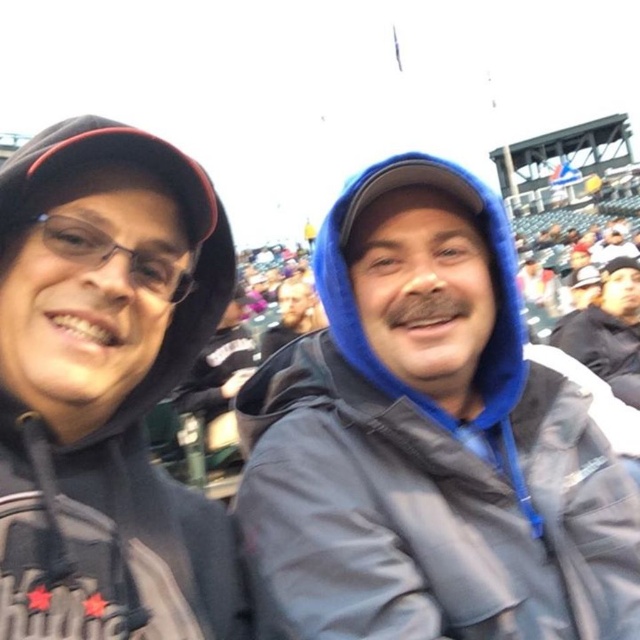
Question: Observing the image, what is the correct spatial positioning of blue fleece jacket at center in reference to black matte jacket at right?

Choices:
 (A) right
 (B) left

Answer: (B)

Question: Which object appears closest to the camera in this image?

Choices:
 (A) black matte jacket at right
 (B) bearded man at center
 (C) blue fleece jacket at center
 (D) black matte hoodie at left

Answer: (D)

Question: Which point appears farthest from the camera in this image?

Choices:
 (A) (637, 362)
 (B) (172, 320)
 (C) (304, 324)

Answer: (C)

Question: Does black matte hoodie at left appear on the left side of black matte jacket at right?

Choices:
 (A) no
 (B) yes

Answer: (B)

Question: In this image, where is blue fleece jacket at center located relative to black matte hoodie at left?

Choices:
 (A) below
 (B) above

Answer: (A)

Question: Which of the following is the farthest from the observer?

Choices:
 (A) (307, 332)
 (B) (557, 344)

Answer: (A)